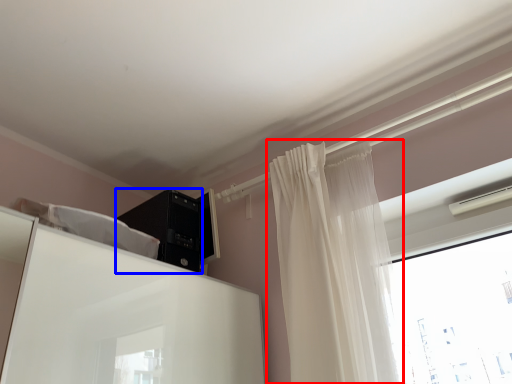
Question: Among these objects, which one is nearest to the camera, curtain (highlighted by a red box) or appliance (highlighted by a blue box)?

Choices:
 (A) curtain
 (B) appliance

Answer: (A)